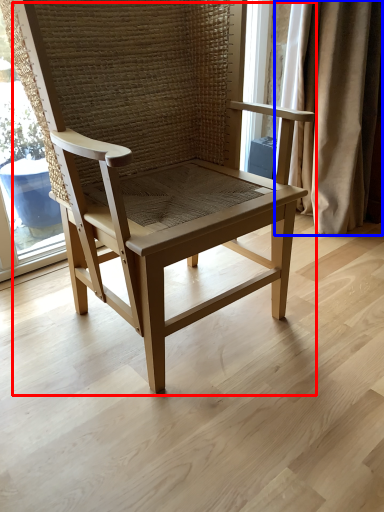
Question: Which object is further to the camera taking this photo, chair (highlighted by a red box) or curtain (highlighted by a blue box)?

Choices:
 (A) chair
 (B) curtain

Answer: (B)